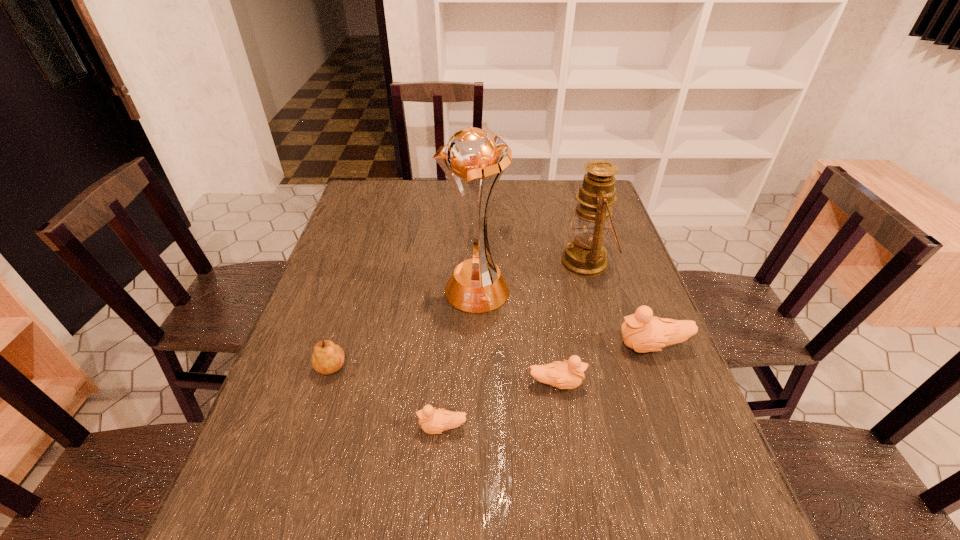
Please point a spot on the left to add another duckling. Please provide its 2D coordinates. Your answer should be formatted as a tuple, i.e. [(x, y)], where the tuple contains the x and y coordinates of a point satisfying the conditions above.

[(307, 481)]